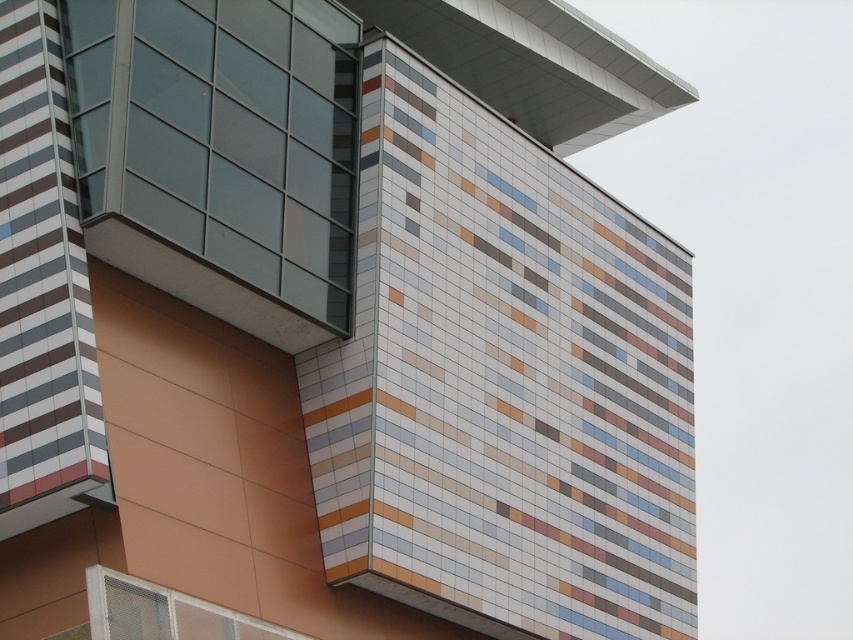
Does transparent glass window at upper left appear under white mesh window at lower left?

No, transparent glass window at upper left is not below white mesh window at lower left.

Is transparent glass window at upper left bigger than white mesh window at lower left?

Yes.

Who is more forward, (242,134) or (123,579)?

Point (123,579) is in front.

Image resolution: width=853 pixels, height=640 pixels. Find the location of `transparent glass window at upper left`. transparent glass window at upper left is located at coordinates [x=219, y=154].